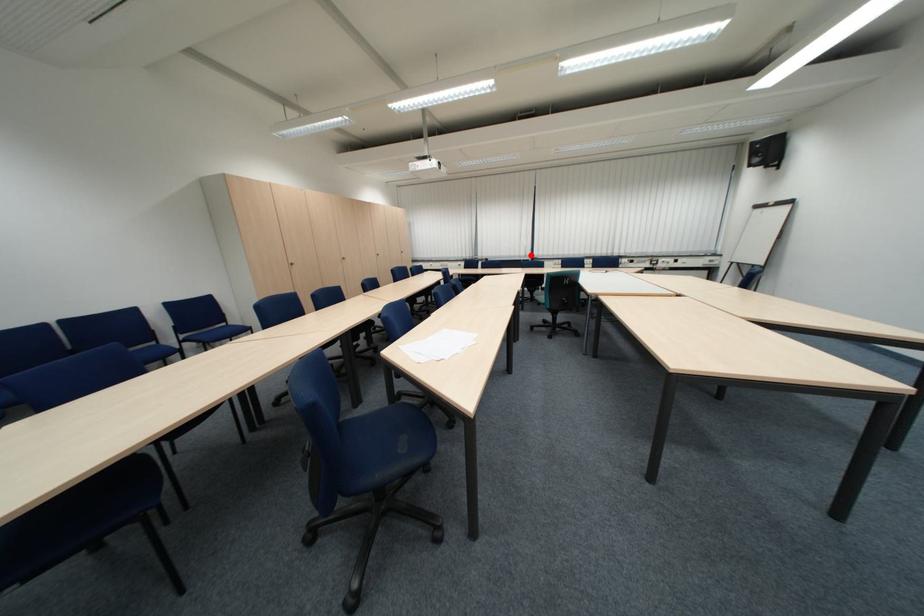
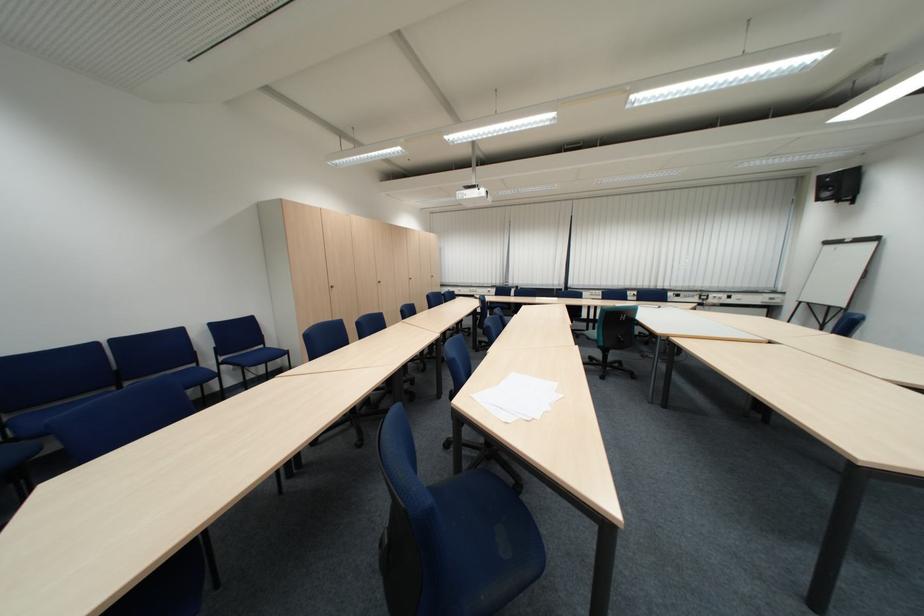
The point at the highlighted location is marked in the first image. Where is the corresponding point in the second image?

(564, 284)